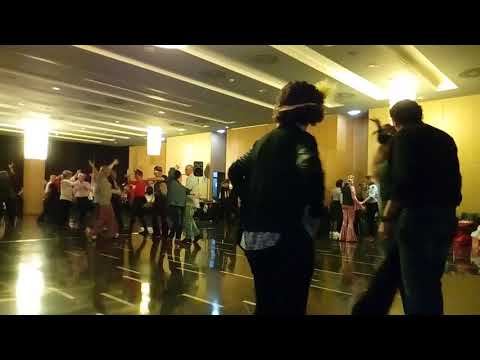
Identify the location of wall in between doors. This screenshot has height=360, width=480. (31, 185).